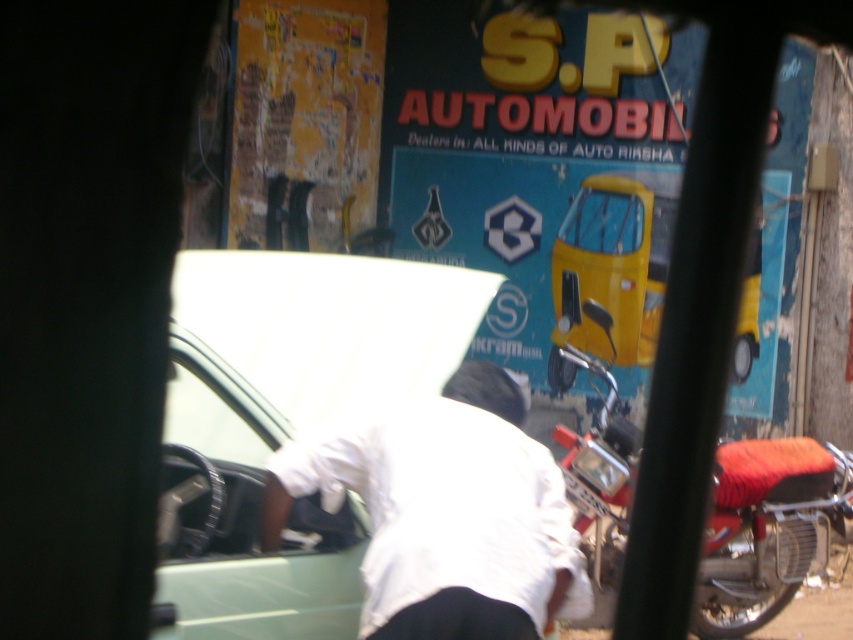
You are a delivery person who needs to place a package on the white cloth at center. The red leather motorcycle at right is blocking the path. Can you safely place the package there without moving the motorcycle?

The white cloth at center and red leather motorcycle at right are 9.93 feet apart. Since the distance between them is sufficient, you can safely place the package on the white cloth at center without moving the motorcycle.

You are a delivery person who needs to place a small package on the white cloth at center and a large package on the red leather motorcycle at right. Based on the scene, can you confirm if both packages will fit without overlapping?

The white cloth at center occupies less space than the red leather motorcycle at right. The small package can fit on the white cloth at center, and the large package can fit on the red leather motorcycle at right since it has more space available.

You are a delivery person who needs to place a small package on the white cloth at center. Based on the scene description, where exactly should you place the package?

The white cloth at center is located at coordinates point [445,502], so you should place the package there.